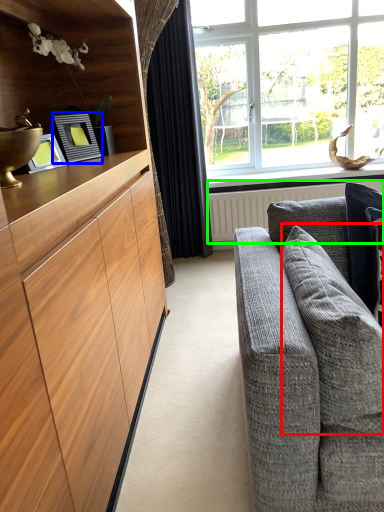
Question: Which object is positioned farthest from pillow (highlighted by a red box)? Select from picture frame (highlighted by a blue box) and radiator (highlighted by a green box).

Choices:
 (A) picture frame
 (B) radiator

Answer: (B)